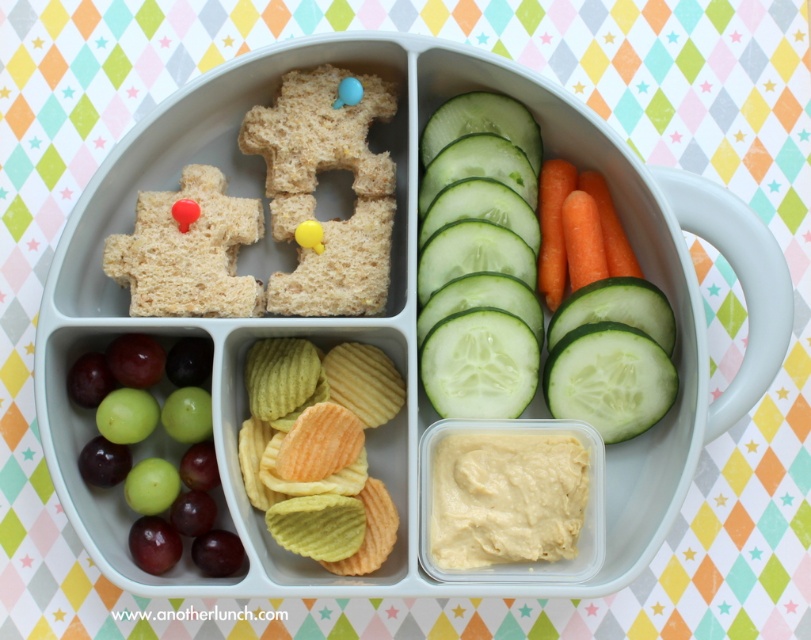
You are a child trying to reach the green ridged chips at center in your bento box. If your hand is currently at position point 0.702, 0.395, can you grab the chips?

The green ridged chips at center are located exactly at position point (320, 449), so yes, you can grab them by reaching your hand to that position.

You are a child trying to reach both the green smooth cucumber at center and the green matte grapes at lower left from your current position. Which one is farther away from you?

The green smooth cucumber at center is farther away from you than the green matte grapes at lower left, as it is 14.50 inches away from them.